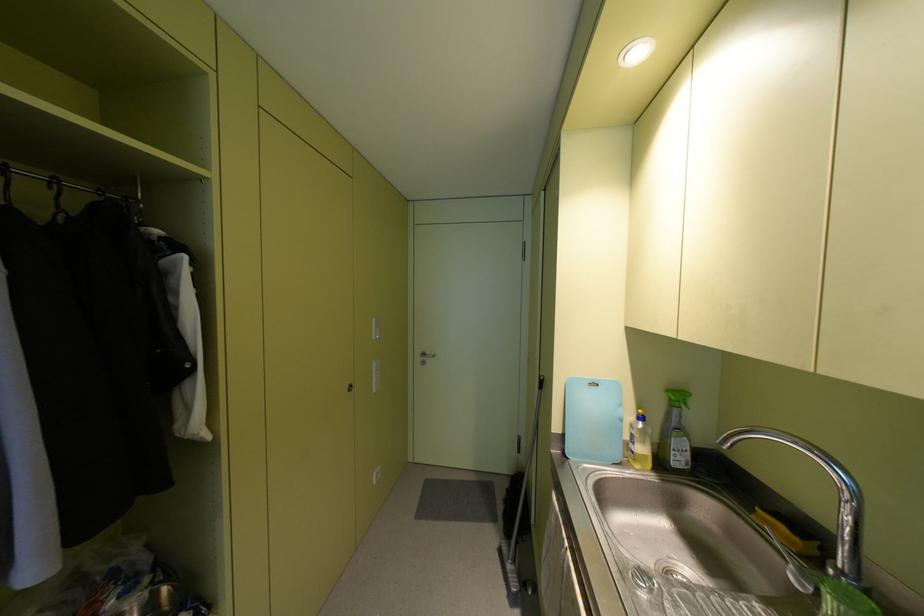
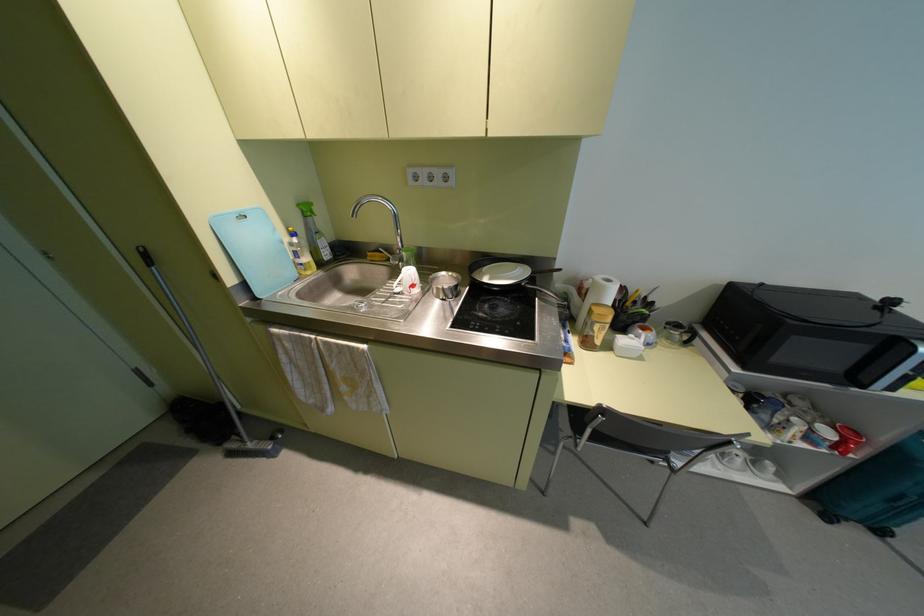
The point at [640,416] is marked in the first image. Where is the corresponding point in the second image?

(293, 233)